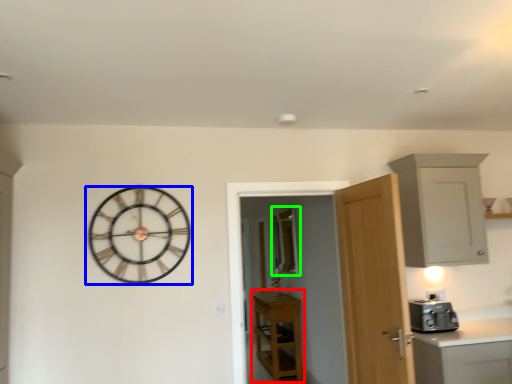
Question: Based on their relative distances, which object is nearer to cabinetry (highlighted by a red box)? Choose from wall clock (highlighted by a blue box) and window (highlighted by a green box).

Choices:
 (A) wall clock
 (B) window

Answer: (B)